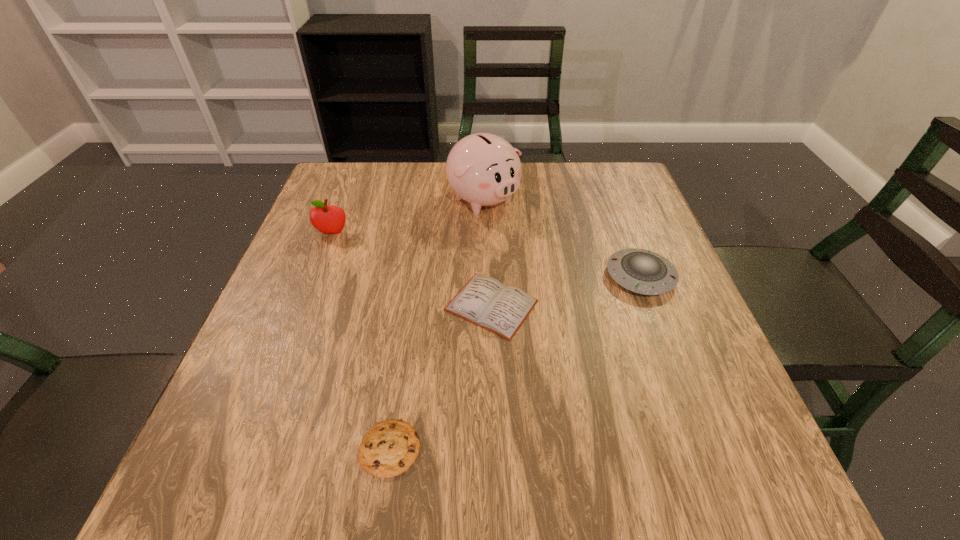
At what (x,y) coordinates should I click in order to perform the action: click on vacant space that's between the diary and the saucer. Please return your answer as a coordinate pair (x, y). This screenshot has width=960, height=540. Looking at the image, I should click on (565, 291).

The image size is (960, 540). Find the location of `vacant area that lies between the rightmost object and the cookie`. vacant area that lies between the rightmost object and the cookie is located at coordinates (516, 362).

This screenshot has width=960, height=540. Find the location of `free point between the rightmost object and the second farthest object`. free point between the rightmost object and the second farthest object is located at coordinates (487, 255).

What are the coordinates of `vacant area that lies between the piggy bank and the diary` in the screenshot? It's located at (488, 253).

Where is `vacant space that's between the farthest object and the diary`? This screenshot has height=540, width=960. vacant space that's between the farthest object and the diary is located at coordinates (488, 253).

Locate an element on the screen. Image resolution: width=960 pixels, height=540 pixels. the closest object to the farthest object is located at coordinates (484, 301).

Identify the location of object that stands as the closest to the diary. The height and width of the screenshot is (540, 960). (641, 271).

Identify the location of vacant space that satisfies the following two spatial constraints: 1. on the back side of the diary; 2. on the right side of the saucer. (491, 276).

The image size is (960, 540). I want to click on vacant area that satisfies the following two spatial constraints: 1. on the back side of the fourth nearest object; 2. on the right side of the farthest object, so click(346, 200).